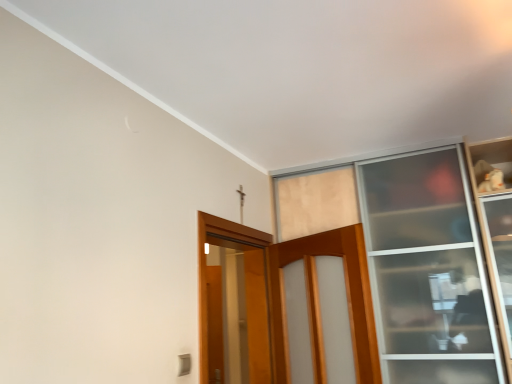
What do you see at coordinates (283, 299) in the screenshot? I see `wooden door at center` at bounding box center [283, 299].

The image size is (512, 384). I want to click on wooden door at center, so click(x=283, y=299).

I want to click on wooden door at center, so click(283, 299).